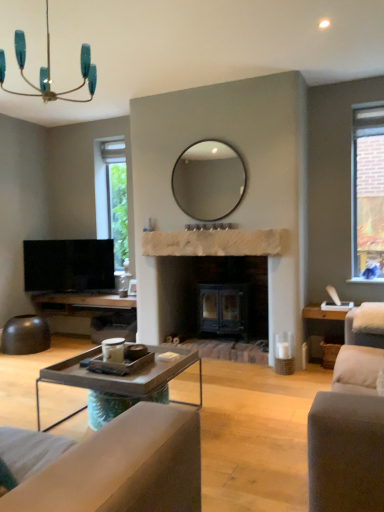
Question: Looking at the image, does flat screen tv at left seem bigger or smaller compared to teal glass chandelier at upper left?

Choices:
 (A) big
 (B) small

Answer: (B)

Question: Is flat screen tv at left taller or shorter than teal glass chandelier at upper left?

Choices:
 (A) short
 (B) tall

Answer: (B)

Question: Which is nearer to the white fabric swivel chair at right?

Choices:
 (A) matte glass mirror at center
 (B) metallic gray coffee table at lower center
 (C) teal glass chandelier at upper left
 (D) flat screen tv at left
 (E) natural stone fireplace at center

Answer: (E)

Question: Based on their relative distances, which object is farther from the flat screen tv at left?

Choices:
 (A) matte glass mirror at center
 (B) natural stone fireplace at center
 (C) metallic gray coffee table at lower center
 (D) teal glass chandelier at upper left
 (E) white fabric swivel chair at right

Answer: (E)